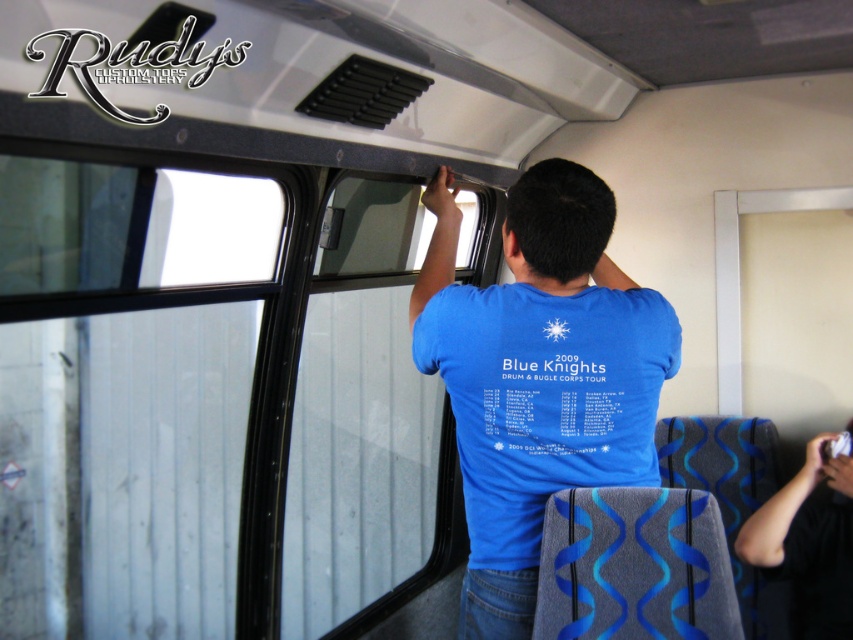
Looking at this image, you are a photographer trying to capture a closeup of the blue matte shirt at upper center and the blue fabric shirt at upper center in the bus interior. Since you want to focus on both shirts equally, which one should you adjust your camera settings to prioritize in terms of focus area size?

The blue matte shirt at upper center has a larger width than the blue fabric shirt at upper center, so you should prioritize adjusting the focus area size to accommodate the larger blue matte shirt at upper center to ensure both shirts are in focus.

You are a passenger on the bus and want to reach the point marked as point (x=552, y=413) which is located near the upper part of the bus window. If your arm can extend 1.5 meters, can you reach that point?

The distance of point (x=552, y=413) from the camera is 1.73 meters. Since your arm can only extend 1.5 meters, you cannot reach the point.

You are inside a bus and see two points marked on the ceiling. The first point is at position (502, 396) and the second point is at (836, 477). Which point is closer to you?

Point (502, 396) is closer to the viewer than point (836, 477).